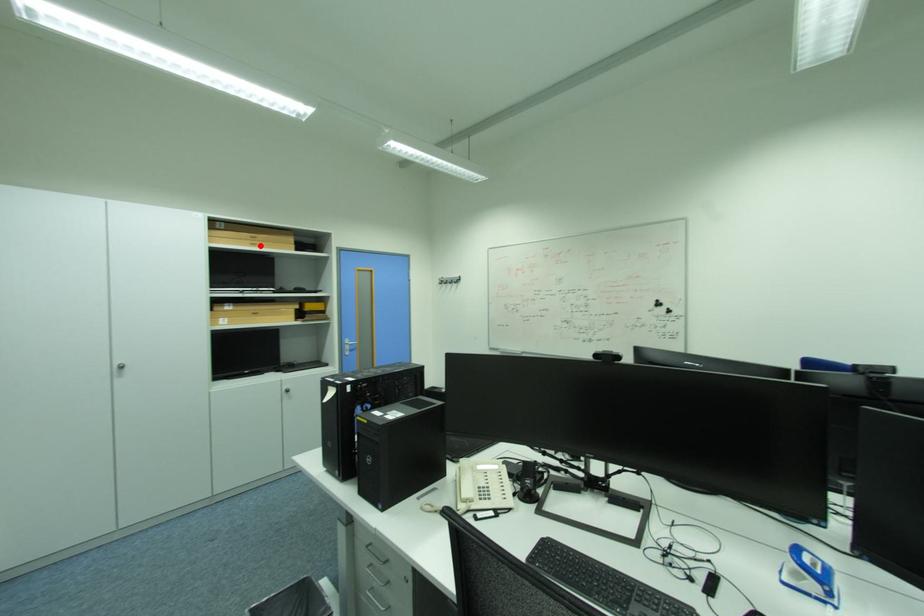
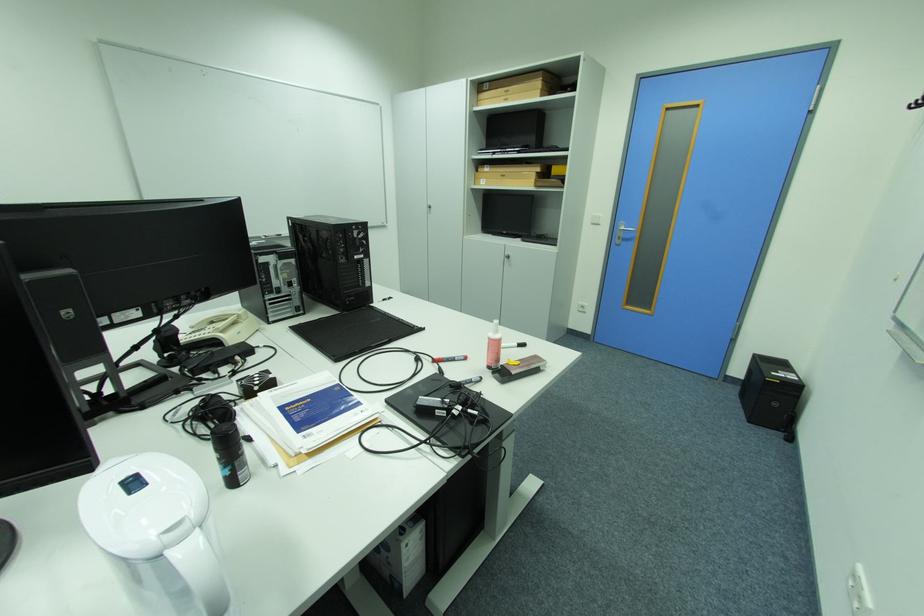
The point at the highlighted location is marked in the first image. Where is the corresponding point in the second image?

(514, 100)